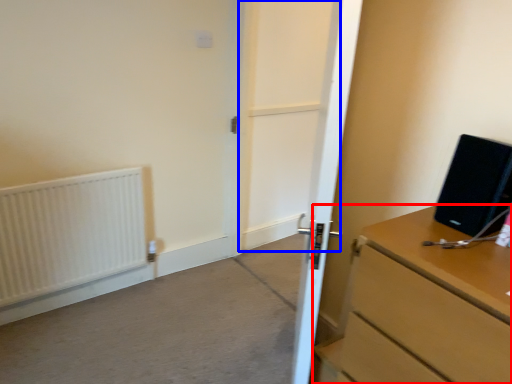
Question: Which object is further to the camera taking this photo, chest of drawers (highlighted by a red box) or screen door (highlighted by a blue box)?

Choices:
 (A) chest of drawers
 (B) screen door

Answer: (B)